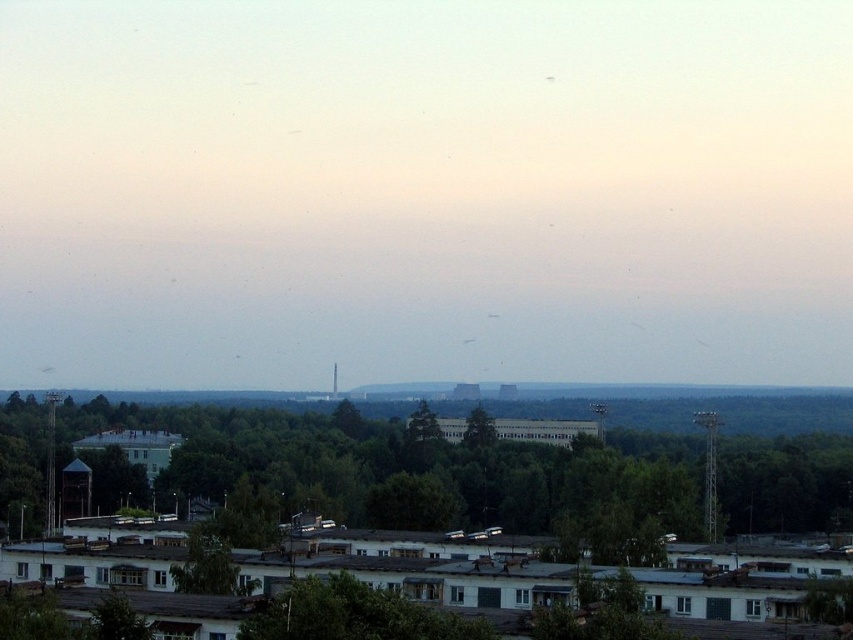
Is green leafy trees at center positioned before green forest at center?

Yes.

Can you confirm if green leafy trees at center is wider than green forest at center?

In fact, green leafy trees at center might be narrower than green forest at center.

Where is `green leafy trees at center`? green leafy trees at center is located at coordinates (454, 474).

Who is shorter, green leafy trees at center or green leafy tree at center?

green leafy tree at center

Does green leafy trees at center appear under green leafy tree at center?

Indeed, green leafy trees at center is positioned under green leafy tree at center.

Is point (477, 515) positioned behind point (473, 438)?

No, (477, 515) is in front of (473, 438).

I want to click on green leafy trees at center, so click(x=454, y=474).

Who is positioned more to the left, green forest at center or green leafy tree at center?

green forest at center

Is point (553, 394) positioned in front of point (471, 426)?

No, it is not.

Who is more distant from viewer, (657, 385) or (491, 417)?

Positioned behind is point (657, 385).

Locate an element on the screen. The image size is (853, 640). green forest at center is located at coordinates (670, 392).